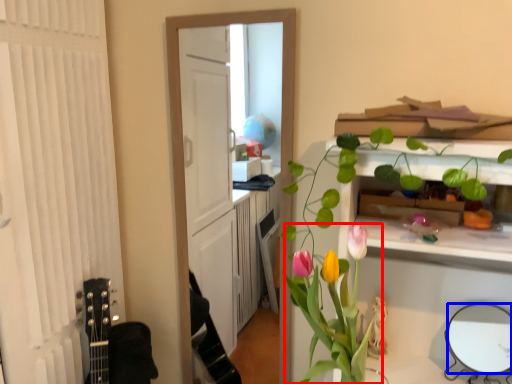
Question: Which object appears closest to the camera in this image, floral arrangement (highlighted by a red box) or mirror (highlighted by a blue box)?

Choices:
 (A) floral arrangement
 (B) mirror

Answer: (A)